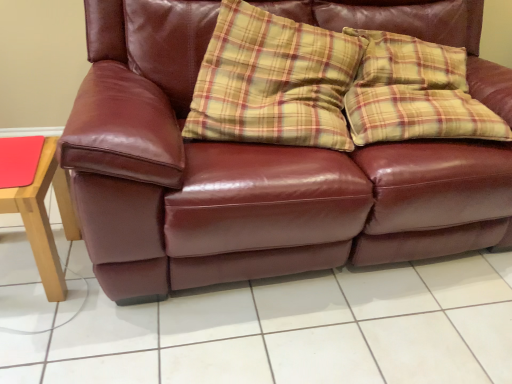
Where is `unoccupied region to the right of matte wood table at left`? unoccupied region to the right of matte wood table at left is located at coordinates (97, 302).